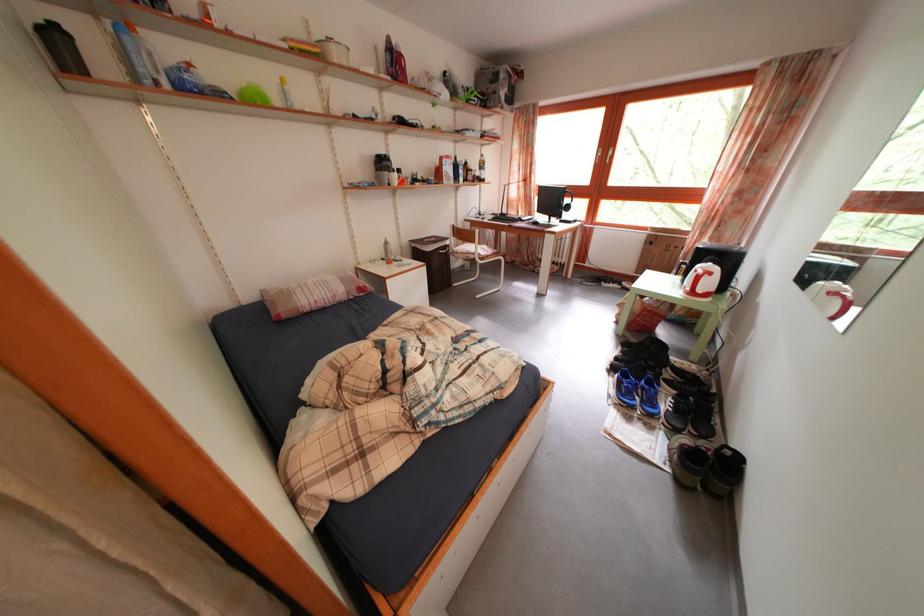
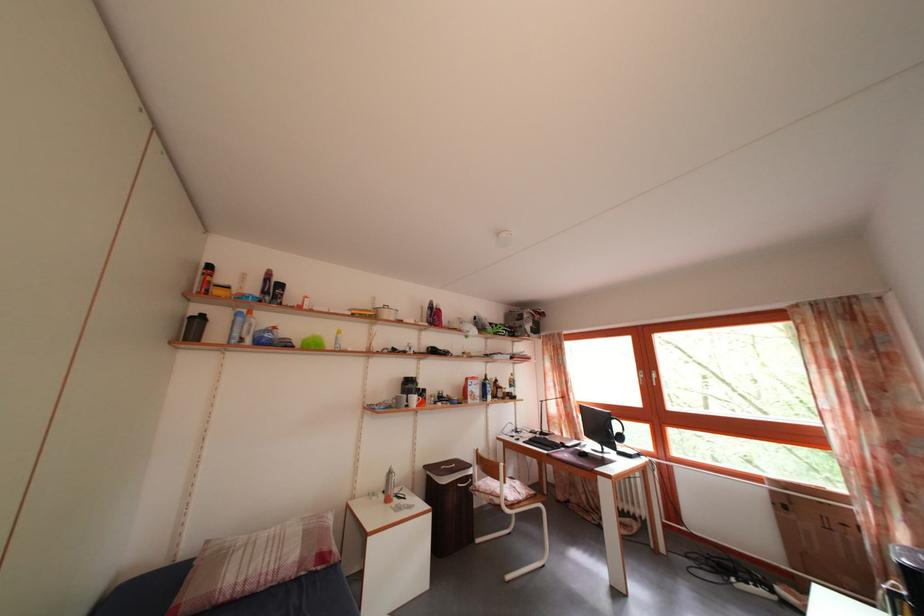
Where in the second image is the point corresponding to (508,222) from the first image?

(550, 440)